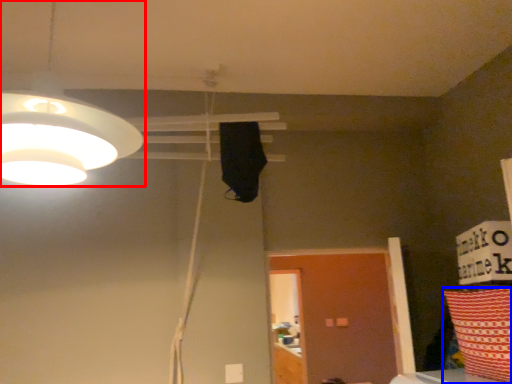
Question: Which point is further to the camera, lamp (highlighted by a red box) or pillow (highlighted by a blue box)?

Choices:
 (A) lamp
 (B) pillow

Answer: (B)